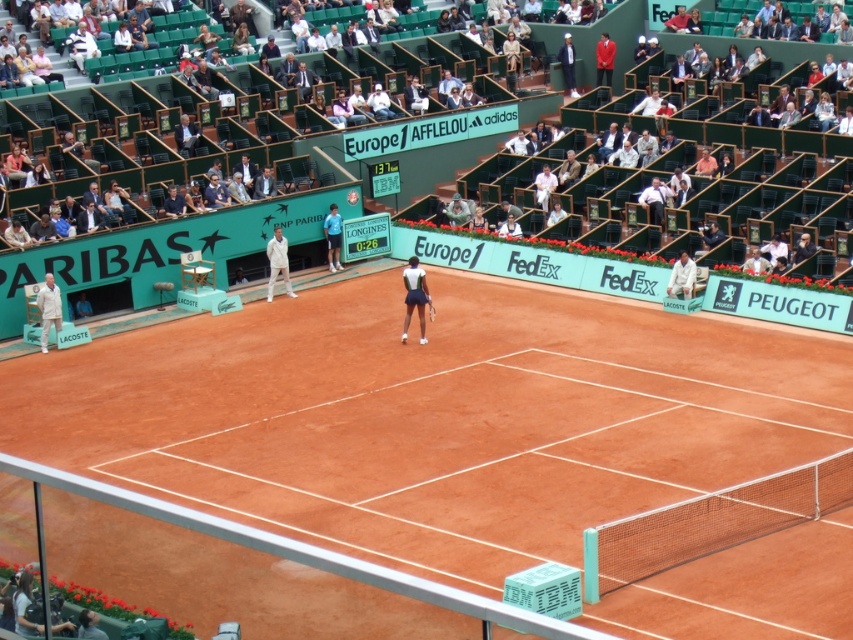
You are a tennis ball that just landed on the clay court. You want to roll towards the white fabric tennis racket at center. Which direction should you go?

The white fabric tennis racket at center is located at point (415, 298). Since you are a tennis ball on the clay court, you should roll towards that coordinate to reach the white fabric tennis racket at center.